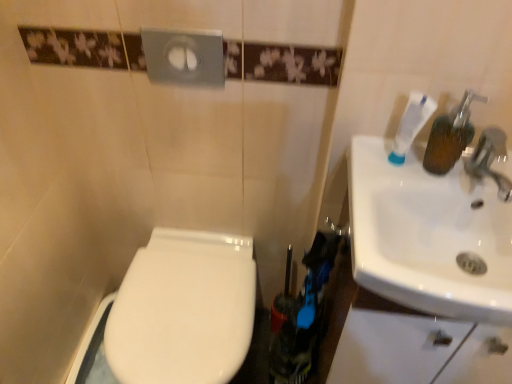
Find the location of a particular element. free space above white glossy toilet at lower left (from a real-world perspective) is located at coordinates (182, 313).